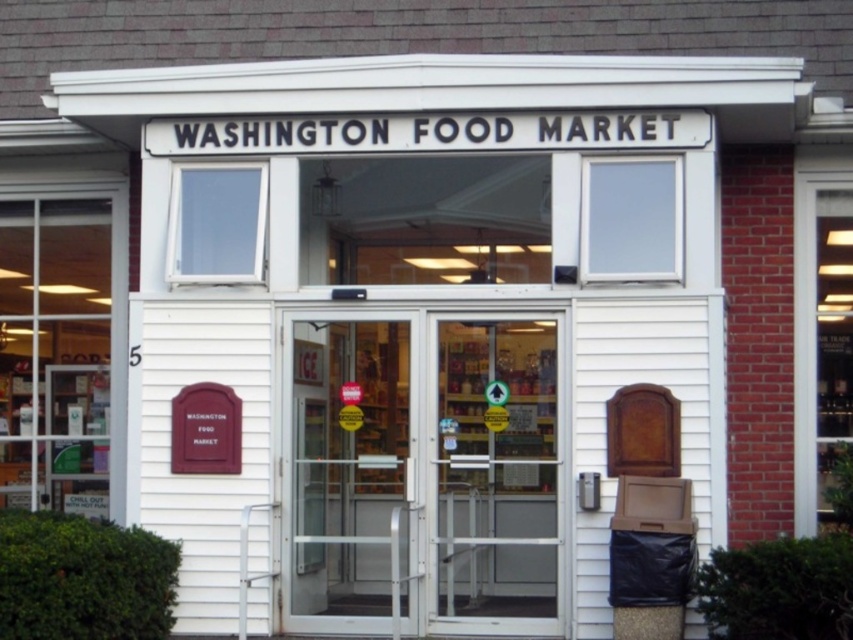
Question: Estimate the real-world distances between objects in this image. Which object is farther from the transparent glass doors at center?

Choices:
 (A) clear glass door at center
 (B) transparent glass door at center

Answer: (A)

Question: Which point is farther to the camera?

Choices:
 (A) (535, 598)
 (B) (438, 538)
 (C) (357, 593)

Answer: (C)

Question: Is transparent glass door at center positioned behind clear glass door at center?

Choices:
 (A) no
 (B) yes

Answer: (A)

Question: Can you confirm if transparent glass doors at center is bigger than clear glass door at center?

Choices:
 (A) no
 (B) yes

Answer: (B)

Question: Which object appears closest to the camera in this image?

Choices:
 (A) transparent glass doors at center
 (B) clear glass door at center

Answer: (A)

Question: Is transparent glass doors at center further to camera compared to clear glass door at center?

Choices:
 (A) yes
 (B) no

Answer: (B)